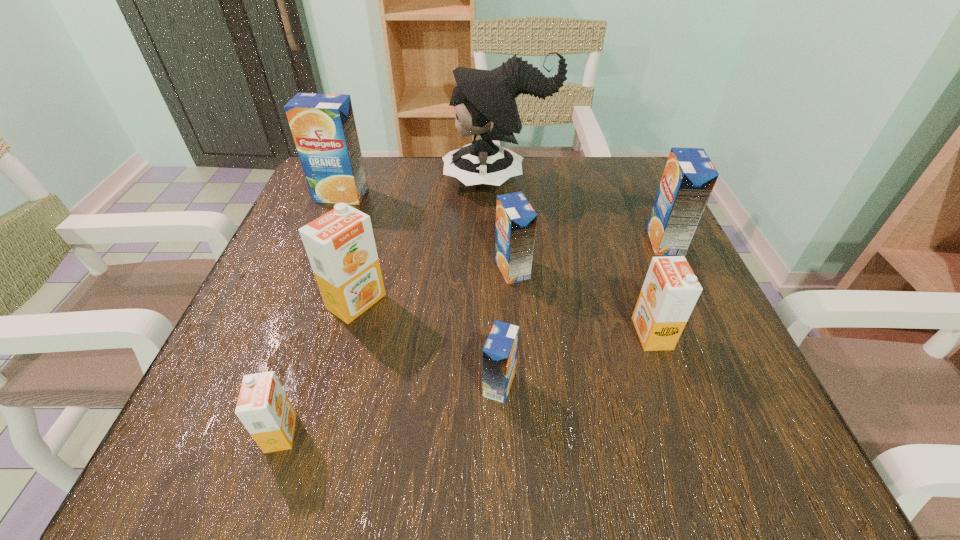
You are a GUI agent. You are given a task and a screenshot of the screen. Output one action in this format:
    pyautogui.click(x=<x>, y=<y>)
    Task: Click on the free space between the seventh object from left to right and the second nearest object
    This screenshot has height=540, width=960.
    Given the screenshot: What is the action you would take?
    pyautogui.click(x=575, y=359)

Locate an element on the screen. Image resolution: width=960 pixels, height=540 pixels. object that is the seventh closest to the rightmost object is located at coordinates (263, 407).

Locate an element on the screen. The image size is (960, 540). the second closest object to the third biggest blue orange_juice is located at coordinates (500, 351).

Choose which orange juice is the fourth nearest neighbor to the biggest orange orange juice. Please provide its 2D coordinates. Your answer should be formatted as a tuple, i.e. [(x, y)], where the tuple contains the x and y coordinates of a point satisfying the conditions above.

[(323, 126)]

Locate an element on the screen. The height and width of the screenshot is (540, 960). orange juice that is the second closest to the tallest object is located at coordinates (516, 220).

Locate an element on the screen. The image size is (960, 540). the second closest blue orange_juice relative to the leftmost blue orange_juice is located at coordinates (500, 351).

The height and width of the screenshot is (540, 960). I want to click on blue orange_juice that is the closest one to the rightmost blue orange_juice, so (x=516, y=220).

What are the coordinates of `orange orange juice that is the third nearest to the second smallest blue orange_juice` in the screenshot? It's located at (263, 407).

Where is `orange orange juice that is the closest to the nearest orange juice`? The height and width of the screenshot is (540, 960). orange orange juice that is the closest to the nearest orange juice is located at coordinates (340, 245).

Locate an element on the screen. free region that satisfies the following two spatial constraints: 1. on the back side of the rightmost blue orange_juice; 2. on the left side of the nearest object is located at coordinates (347, 241).